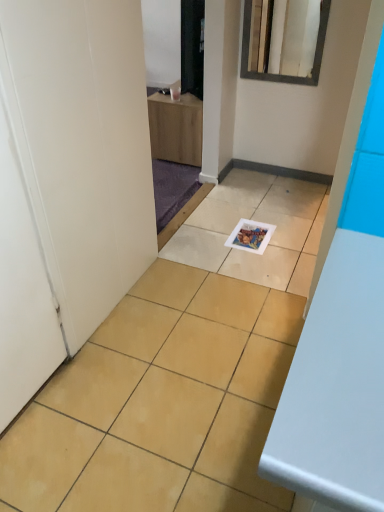
Image resolution: width=384 pixels, height=512 pixels. I want to click on vacant area that lies between white matte door at left and matte paper magazine at center, so click(168, 303).